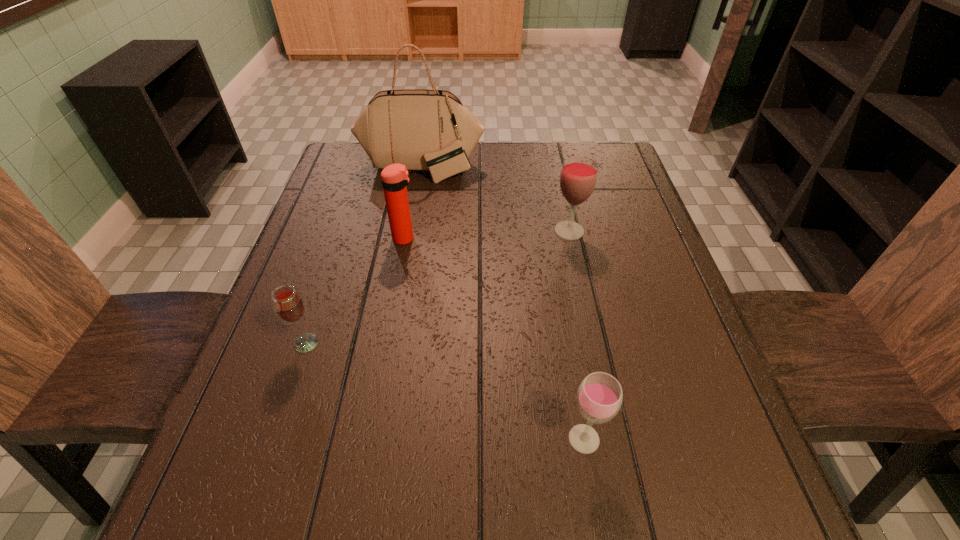
Find the location of `free point between the farthest object and the thermos bottle`. free point between the farthest object and the thermos bottle is located at coordinates (413, 204).

At what (x,y) coordinates should I click in order to perform the action: click on object that stands as the second closest to the nearest object. Please return your answer as a coordinate pair (x, y). This screenshot has height=540, width=960. Looking at the image, I should click on (289, 306).

The width and height of the screenshot is (960, 540). Identify the location of object that is the third closest one to the nearest wineglass. (394, 177).

Identify which wineglass is the second nearest to the farthest object. Please provide its 2D coordinates. Your answer should be formatted as a tuple, i.e. [(x, y)], where the tuple contains the x and y coordinates of a point satisfying the conditions above.

[(289, 306)]

Find the location of `wineglass that can be found as the third closest to the farthest object`. wineglass that can be found as the third closest to the farthest object is located at coordinates (599, 397).

Image resolution: width=960 pixels, height=540 pixels. Find the location of `free point that satisfies the following two spatial constraints: 1. on the side of the nearest wineglass with the attached pouch; 2. on the right side of the tallest object`. free point that satisfies the following two spatial constraints: 1. on the side of the nearest wineglass with the attached pouch; 2. on the right side of the tallest object is located at coordinates (375, 438).

The image size is (960, 540). Find the location of `vacant space that satisfies the following two spatial constraints: 1. on the side of the tallest object with the attached pouch; 2. on the left side of the nearest object`. vacant space that satisfies the following two spatial constraints: 1. on the side of the tallest object with the attached pouch; 2. on the left side of the nearest object is located at coordinates (375, 438).

I want to click on vacant region that satisfies the following two spatial constraints: 1. on the back side of the farthest wineglass; 2. on the left side of the nearest wineglass, so click(549, 231).